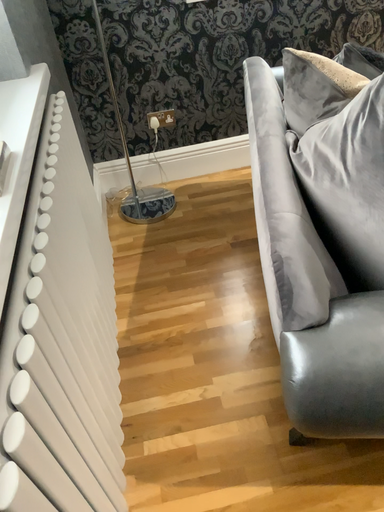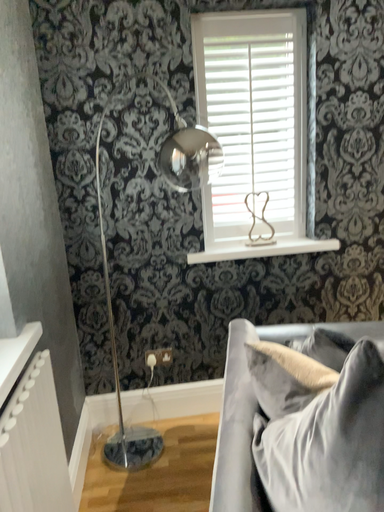
Question: How did the camera likely rotate when shooting the video?

Choices:
 (A) rotated downward
 (B) rotated upward

Answer: (B)